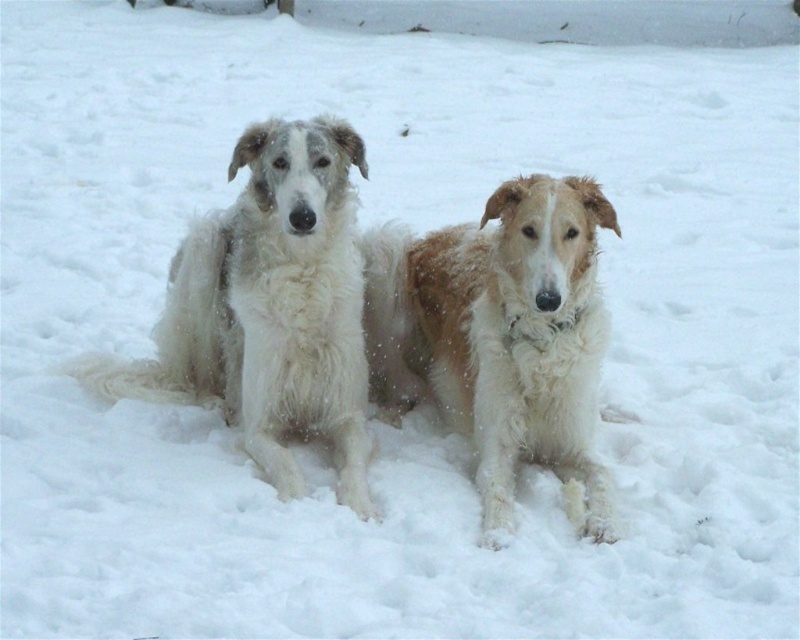
Question: Can you confirm if fuzzy white dog at center is thinner than white fluffy dog at left?

Choices:
 (A) yes
 (B) no

Answer: (A)

Question: Which of the following is the closest to the observer?

Choices:
 (A) click(x=184, y=326)
 (B) click(x=506, y=385)

Answer: (B)

Question: Which object is closer to the camera taking this photo?

Choices:
 (A) fuzzy white dog at center
 (B) white fluffy dog at left

Answer: (A)

Question: In this image, where is fuzzy white dog at center located relative to white fluffy dog at left?

Choices:
 (A) above
 (B) below

Answer: (A)

Question: Where is fuzzy white dog at center located in relation to white fluffy dog at left in the image?

Choices:
 (A) above
 (B) below

Answer: (A)

Question: Which point is closer to the camera taking this photo?

Choices:
 (A) (274, 211)
 (B) (444, 260)

Answer: (A)